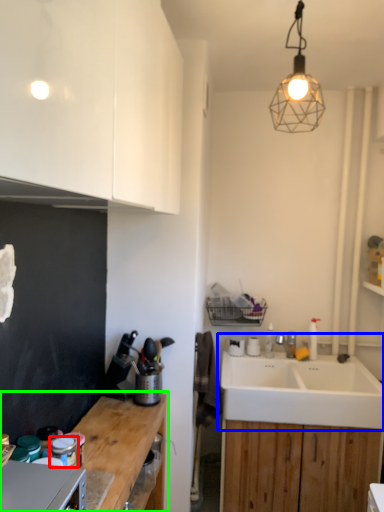
Question: Considering the real-world distances, which object is farthest from appliance (highlighted by a red box)? sink (highlighted by a blue box) or countertop (highlighted by a green box)?

Choices:
 (A) sink
 (B) countertop

Answer: (A)